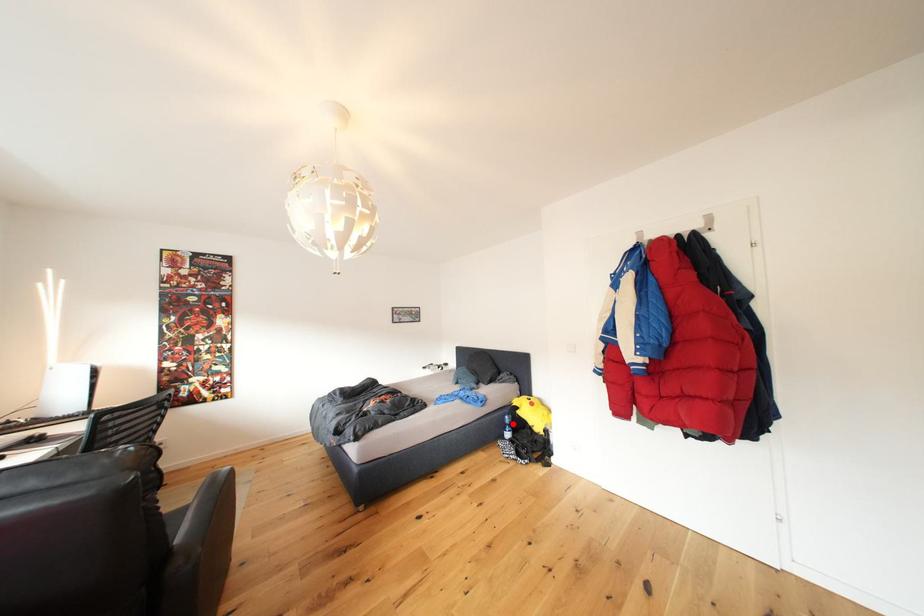
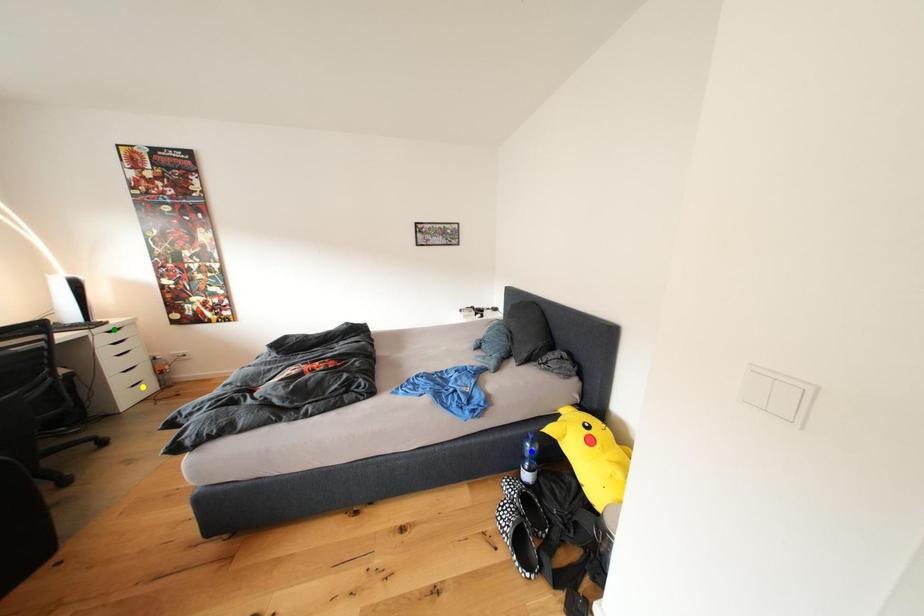
Question: I am providing you with two images of the same scene from different viewpoints. A red point is marked on the first image. You are given multiple points on the second image. Which point in image 2 represents the same 3d spot as the red point in image 1?

Choices:
 (A) blue point
 (B) green point
 (C) yellow point

Answer: (A)